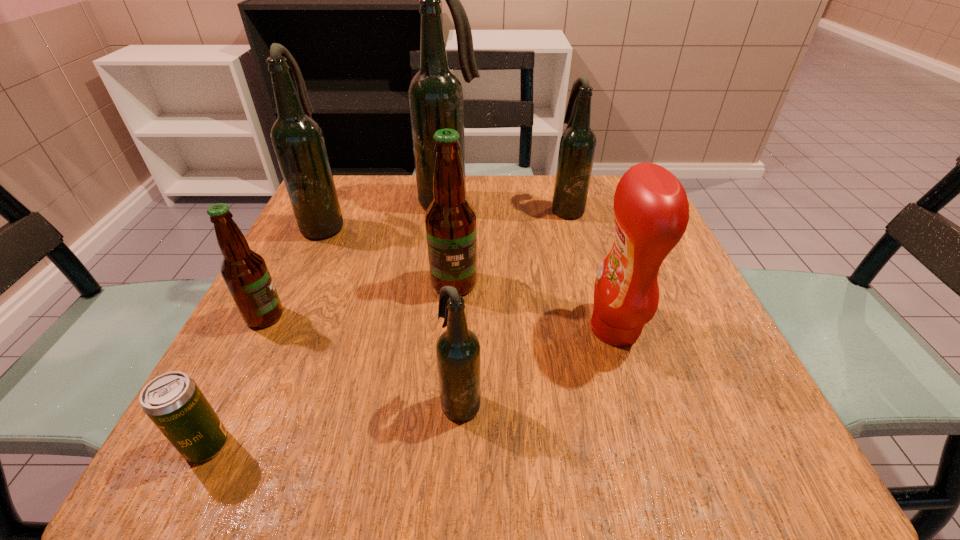
This screenshot has width=960, height=540. In order to click on the second nearest beer bottle in this screenshot , I will do `click(244, 271)`.

The image size is (960, 540). I want to click on the nearest dark beer bottle, so click(458, 352).

The image size is (960, 540). What are the coordinates of `the nearest beer bottle` in the screenshot? It's located at (458, 352).

Where is `the shortest object`? The width and height of the screenshot is (960, 540). the shortest object is located at coordinates (173, 401).

This screenshot has height=540, width=960. Find the location of `the nearest object`. the nearest object is located at coordinates (173, 401).

The width and height of the screenshot is (960, 540). Identify the location of free location located on the right of the tallest beer bottle. (505, 202).

Image resolution: width=960 pixels, height=540 pixels. I want to click on vacant space located on the back of the second tallest beer bottle, so click(343, 185).

The height and width of the screenshot is (540, 960). I want to click on free spot located 0.330m on the left of the rightmost beer bottle, so click(412, 208).

Image resolution: width=960 pixels, height=540 pixels. What are the coordinates of `blank space located 0.140m on the label of the third nearest beer bottle` in the screenshot? It's located at (449, 360).

At what (x,y) coordinates should I click in order to perform the action: click on vacant position located on the label side of the condiment. Please return your answer as a coordinate pair (x, y). This screenshot has height=540, width=960. Looking at the image, I should click on (500, 329).